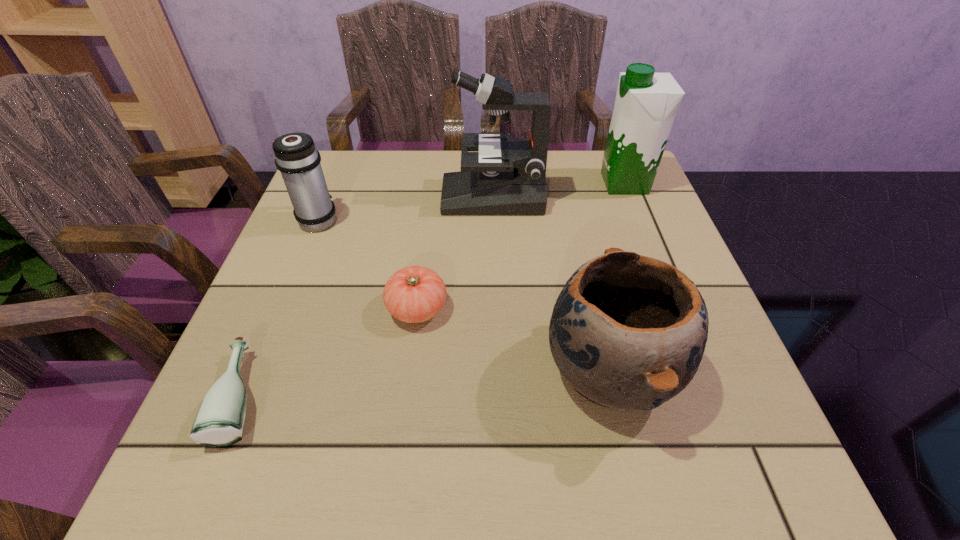
Where is `pottery that is at the near edge`? The height and width of the screenshot is (540, 960). pottery that is at the near edge is located at coordinates (627, 331).

Where is `bottle at the near edge`? bottle at the near edge is located at coordinates (220, 421).

At what (x,y) coordinates should I click in order to perform the action: click on thermos bottle positioned at the left edge. Please return your answer as a coordinate pair (x, y). Looking at the image, I should click on (296, 157).

I want to click on bottle that is at the left edge, so click(220, 421).

What are the coordinates of `soya milk that is at the right edge` in the screenshot? It's located at (646, 103).

The width and height of the screenshot is (960, 540). What are the coordinates of `pottery at the right edge` in the screenshot? It's located at (627, 331).

You are a GUI agent. You are given a task and a screenshot of the screen. Output one action in this format:
    pyautogui.click(x=<x>, y=<y>)
    Task: Click on the object located at the near left corner
    The height and width of the screenshot is (540, 960).
    Given the screenshot: What is the action you would take?
    pyautogui.click(x=220, y=421)

Find the location of a particular element. The image size is (960, 540). object at the far right corner is located at coordinates 646,103.

Locate an element on the screen. The width and height of the screenshot is (960, 540). object at the near right corner is located at coordinates (627, 331).

Locate an element on the screen. Image resolution: width=960 pixels, height=540 pixels. free space at the far edge of the desktop is located at coordinates (387, 195).